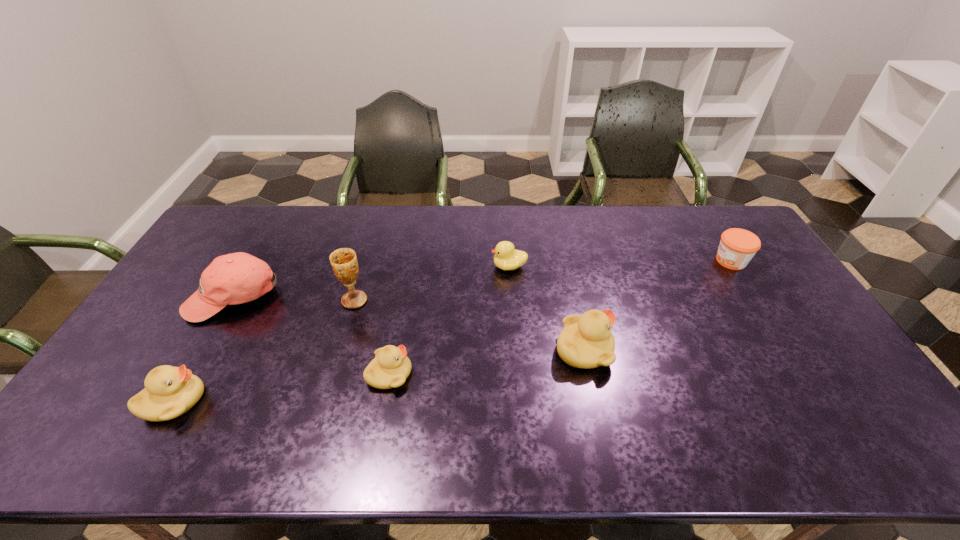
Image resolution: width=960 pixels, height=540 pixels. In order to click on the fourth shortest object in this screenshot , I will do `click(169, 392)`.

Where is `the leftmost duckling`? This screenshot has width=960, height=540. the leftmost duckling is located at coordinates (169, 392).

Find the location of a particular element. This screenshot has width=960, height=540. the second duckling from left to right is located at coordinates (390, 368).

What are the coordinates of `the second object from right to left` in the screenshot? It's located at (586, 341).

This screenshot has width=960, height=540. In order to click on jam in this screenshot , I will do `click(737, 247)`.

The image size is (960, 540). Find the location of `the farthest duckling`. the farthest duckling is located at coordinates (506, 257).

Locate an element on the screen. The height and width of the screenshot is (540, 960). the third object from right to left is located at coordinates (506, 257).

Locate an element on the screen. The height and width of the screenshot is (540, 960). the tallest object is located at coordinates (344, 263).

Image resolution: width=960 pixels, height=540 pixels. I want to click on the fifth object from right to left, so click(344, 263).

This screenshot has height=540, width=960. I want to click on baseball cap, so click(236, 278).